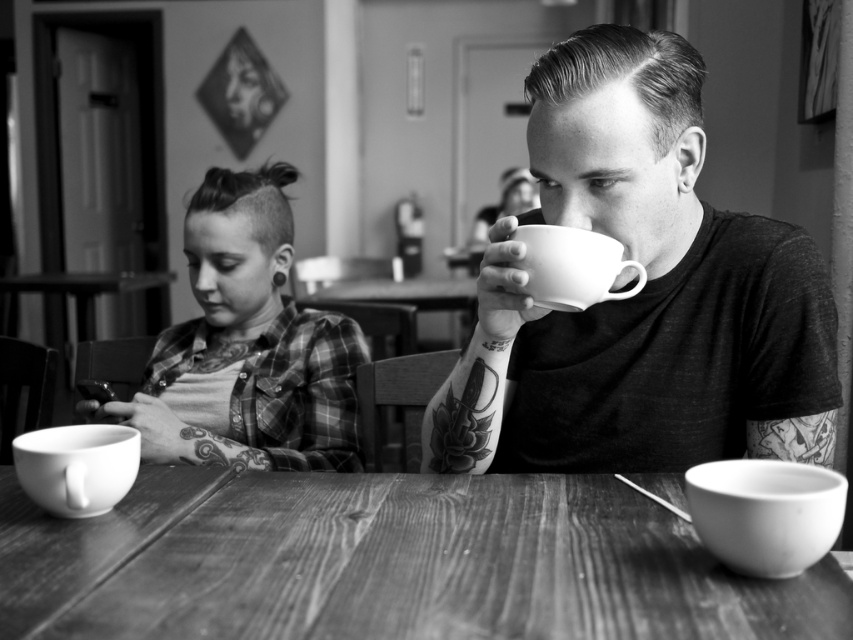
You are a photographer trying to capture a candid shot of the scene. You want to ensure that both the plaid shirt at left and the white ceramic mug at lower right are clearly visible in the frame. Given their sizes, which object should you focus on first to ensure proper focus and exposure?

The plaid shirt at left is much taller than the white ceramic mug at lower right, so you should focus on the plaid shirt at left first to ensure proper focus and exposure since it is larger and more prominent in the scene.